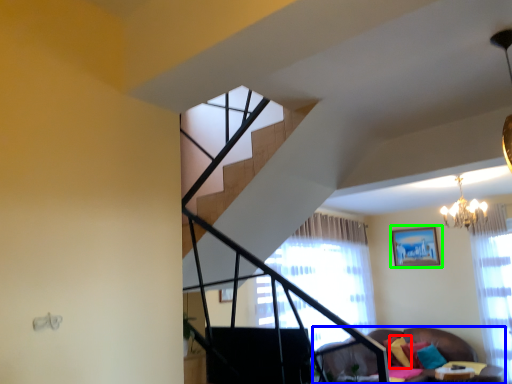
Question: Based on their relative distances, which object is nearer to pillow (highlighted by a red box)? Choose from studio couch (highlighted by a blue box) and picture frame (highlighted by a green box).

Choices:
 (A) studio couch
 (B) picture frame

Answer: (B)